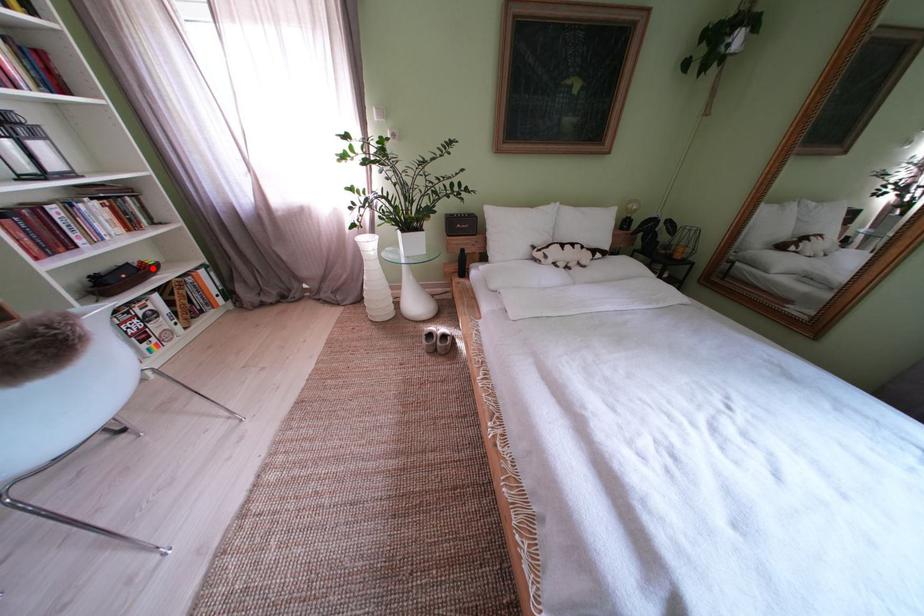
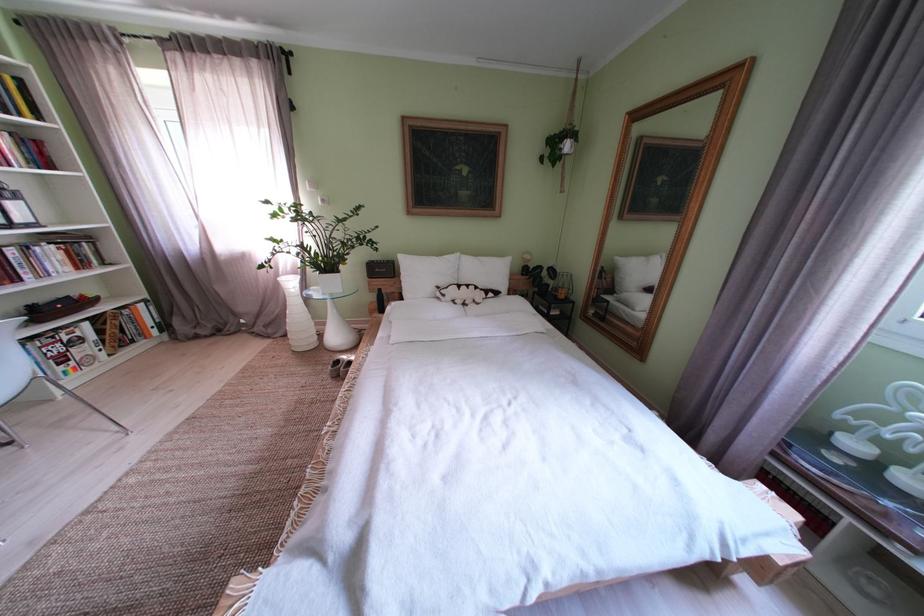
Question: I am providing you with two images of the same scene from different viewpoints. Given a red point in image1, look at the same physical point in image2. Is it:

Choices:
 (A) Closer to the viewpoint
 (B) Farther from the viewpoint

Answer: (B)